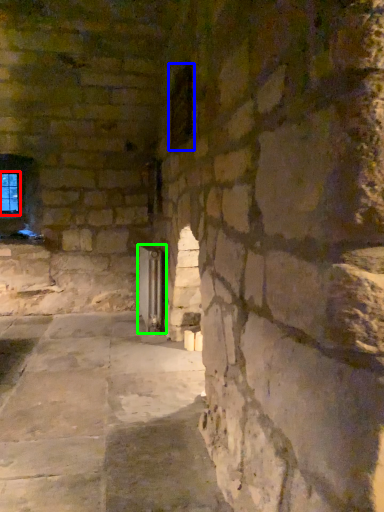
Question: Based on their relative distances, which object is farther from window (highlighted by a red box)? Choose from window (highlighted by a blue box) and glass door (highlighted by a green box).

Choices:
 (A) window
 (B) glass door

Answer: (A)